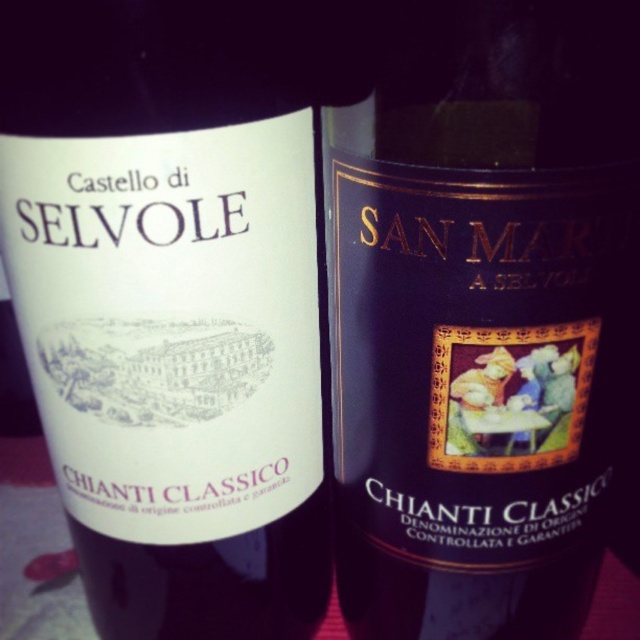
You are holding a white matte wine bottle at center and want to place it on a table that is 16 inches away from you. Can you reach the table without moving your position?

The white matte wine bottle at center is 17.26 inches away from the viewer, so placing it on a table that is 16 inches away would require moving closer since the current distance is greater than the table distance.

You are standing in front of the two Chianti Classico wine bottles. There are two points marked on the image. The first point is at coordinates point (122,496) and the second is at point (528,291). If you were to touch both points with your finger, which point would you reach first?

Point (122,496) is closer to you than point (528,291), so you would reach it first.

You are arranging wine bottles on a shelf and need to know which one is thinner between the white matte wine bottle at center and the dark purple matte bottle at center. Which one should you choose?

The white matte wine bottle at center is thinner than the dark purple matte bottle at center, so you should choose the white matte wine bottle at center.